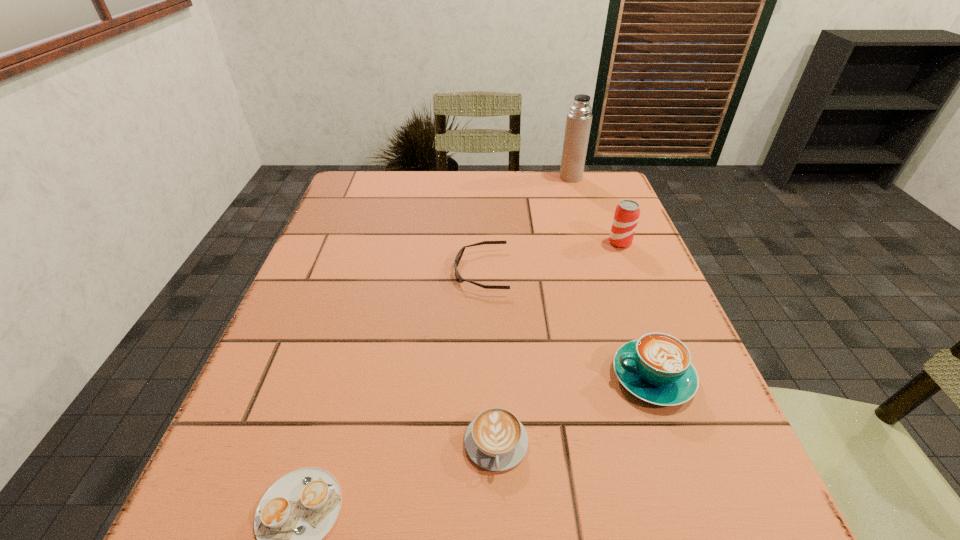
I want to click on the tallest object, so click(578, 124).

Locate an element on the screen. the farthest object is located at coordinates (578, 124).

The width and height of the screenshot is (960, 540). Find the location of `the second tallest object`. the second tallest object is located at coordinates (627, 212).

At what (x,y) coordinates should I click in order to perform the action: click on beer can. Please return your answer as a coordinate pair (x, y). The height and width of the screenshot is (540, 960). Looking at the image, I should click on (627, 212).

This screenshot has height=540, width=960. Identify the location of the tallest cappuccino. (657, 368).

You are a GUI agent. You are given a task and a screenshot of the screen. Output one action in this format:
    pyautogui.click(x=<x>, y=<y>)
    Task: Click on the third nearest object
    The width and height of the screenshot is (960, 540).
    Given the screenshot: What is the action you would take?
    pyautogui.click(x=657, y=368)

This screenshot has height=540, width=960. Identify the location of the second tallest cappuccino. (495, 440).

What are the coordinates of `the third shortest object` in the screenshot? It's located at (495, 440).

Find the location of `the fourth nearest object`. the fourth nearest object is located at coordinates (458, 257).

At what (x,y) coordinates should I click in order to perform the action: click on free space located on the left of the thermos bottle. Please return your answer as a coordinate pair (x, y). This screenshot has height=540, width=960. Looking at the image, I should click on (539, 177).